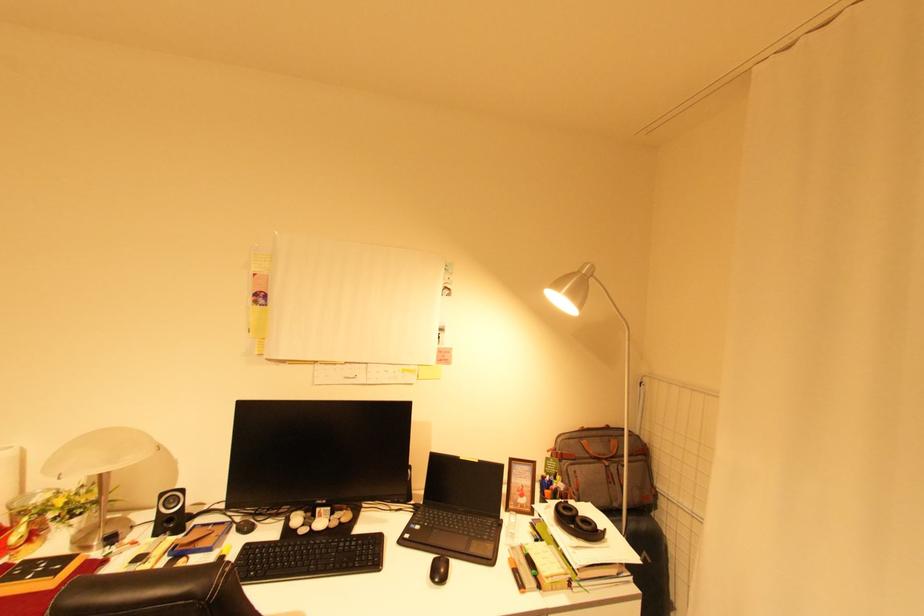
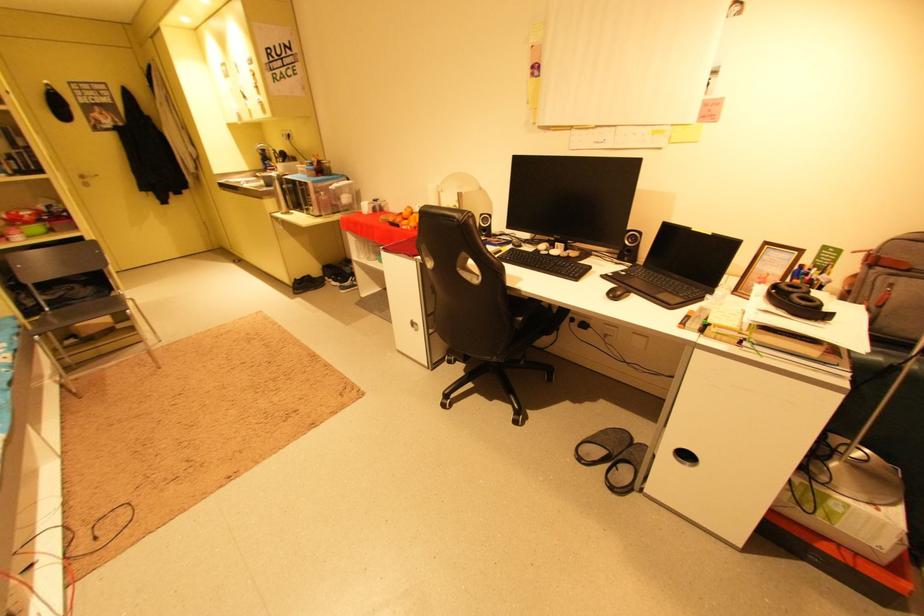
Where in the second image is the point corresponding to (529,496) from the first image?

(769, 285)